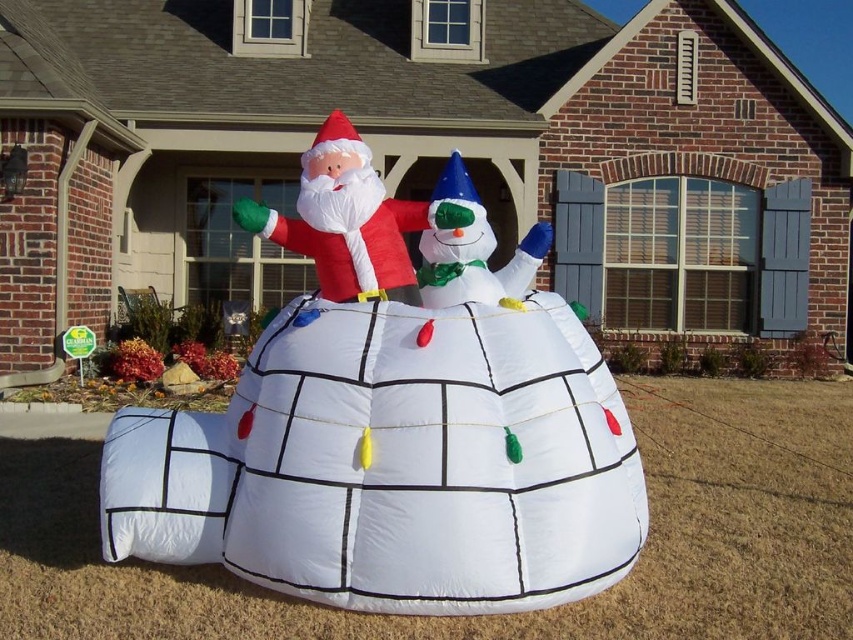
Does matte red santa at center have a greater height compared to white glossy snowman at center?

Yes, matte red santa at center is taller than white glossy snowman at center.

Which is in front, point (309, 160) or point (467, 200)?

Point (467, 200) is in front.

Who is more distant from viewer, (392,252) or (456,301)?

The point (392,252) is behind.

Locate an element on the screen. The width and height of the screenshot is (853, 640). matte red santa at center is located at coordinates (343, 220).

Between point (526, 417) and point (503, 266), which one is positioned behind?

The point (503, 266) is behind.

Can you confirm if white inflatable snowman at center is positioned to the left of white glossy snowman at center?

Indeed, white inflatable snowman at center is positioned on the left side of white glossy snowman at center.

This screenshot has width=853, height=640. Describe the element at coordinates (393, 420) in the screenshot. I see `white inflatable snowman at center` at that location.

Locate an element on the screen. The image size is (853, 640). white inflatable snowman at center is located at coordinates (393, 420).

Is white inflatable snowman at center thinner than matte red santa at center?

In fact, white inflatable snowman at center might be wider than matte red santa at center.

Is white inflatable snowman at center to the left of matte red santa at center from the viewer's perspective?

Incorrect, white inflatable snowman at center is not on the left side of matte red santa at center.

Find the location of `white inflatable snowman at center`. white inflatable snowman at center is located at coordinates (393, 420).

Where is `white inflatable snowman at center`? white inflatable snowman at center is located at coordinates (393, 420).